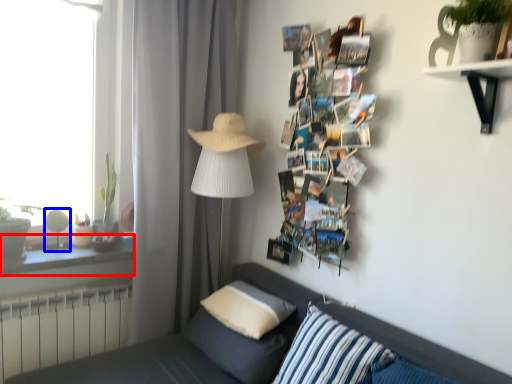
Question: Which of the following is the farthest to the observer, window sill (highlighted by a red box) or table lamp (highlighted by a blue box)?

Choices:
 (A) window sill
 (B) table lamp

Answer: (B)